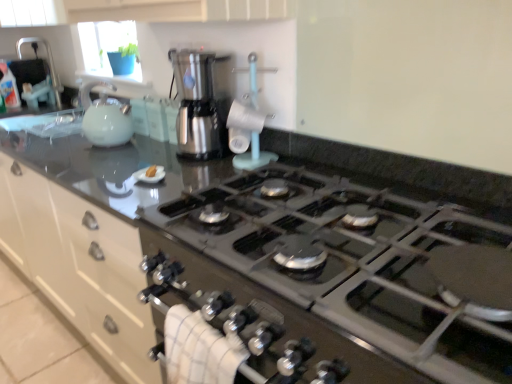
Question: Is brushed metal sink at upper left to the left or to the right of black glass stove at center in the image?

Choices:
 (A) right
 (B) left

Answer: (B)

Question: Is brushed metal sink at upper left wider or thinner than black glass stove at center?

Choices:
 (A) wide
 (B) thin

Answer: (B)

Question: Considering the real-world distances, which object is closest to the yellow sponge at center?

Choices:
 (A) stainless steel coffee maker at center, arranged as the second kitchen appliance when viewed from the left
 (B) black glass stove at center
 (C) matte white kettle at left, the 2th kitchen appliance from the right
 (D) white glossy cabinet at upper center
 (E) brushed metal sink at upper left

Answer: (A)

Question: Estimate the real-world distances between objects in this image. Which object is closer to the matte white kettle at left, the 2th kitchen appliance from the right?

Choices:
 (A) white glossy cabinet at upper center
 (B) brushed metal sink at upper left
 (C) yellow sponge at center
 (D) black glass stove at center
 (E) stainless steel coffee maker at center, arranged as the second kitchen appliance when viewed from the left

Answer: (A)